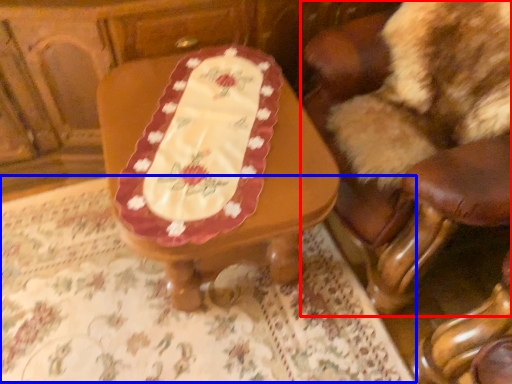
Question: Which object is further to the camera taking this photo, chair (highlighted by a red box) or tablecloth (highlighted by a blue box)?

Choices:
 (A) chair
 (B) tablecloth

Answer: (B)